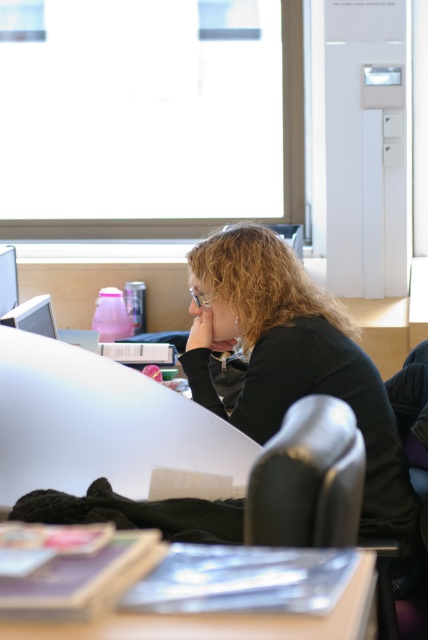
Which is behind, point (104, 464) or point (240, 634)?

Point (104, 464)

Is white glossy desk at center bigger than matte plastic table at lower center?

Yes, white glossy desk at center is bigger than matte plastic table at lower center.

You are a GUI agent. You are given a task and a screenshot of the screen. Output one action in this format:
    pyautogui.click(x=<x>, y=<y>)
    Task: Click on the white glossy desk at center
    The image size is (428, 640).
    Given the screenshot: What is the action you would take?
    pyautogui.click(x=98, y=422)

Which is below, black matte jacket at center or matte plastic table at lower center?

matte plastic table at lower center is below.

Describe the element at coordinates (291, 360) in the screenshot. The image size is (428, 640). I see `black matte jacket at center` at that location.

The width and height of the screenshot is (428, 640). In order to click on black matte jacket at center in this screenshot , I will do `click(291, 360)`.

Is black matte jacket at center above white glossy desk at center?

Yes, black matte jacket at center is above white glossy desk at center.

Which is more to the left, black matte jacket at center or white glossy desk at center?

white glossy desk at center is more to the left.

Is point (267, 244) more distant than point (8, 355)?

Yes.

Identify the location of black matte jacket at center. Image resolution: width=428 pixels, height=640 pixels. (291, 360).